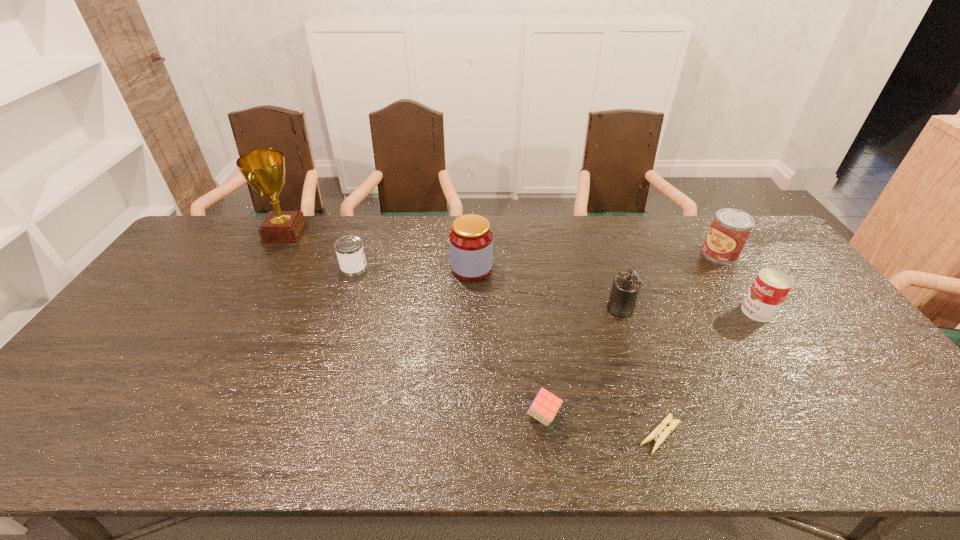
This screenshot has height=540, width=960. Identify the location of vacant point located 0.330m on the plaque of the award. (x=397, y=233).

The height and width of the screenshot is (540, 960). I want to click on vacant space located on the right of the second tallest object, so click(558, 268).

Locate an element on the screen. vacant space located on the back of the second can from left to right is located at coordinates (597, 239).

Where is `free space located 0.070m on the front of the leftmost can`? This screenshot has height=540, width=960. free space located 0.070m on the front of the leftmost can is located at coordinates (347, 292).

Find the location of a particular element. free region located 0.290m on the back of the fourth object from left to right is located at coordinates (531, 313).

I want to click on free space located 0.120m on the right of the clothespin, so click(737, 435).

Locate an element on the screen. Image resolution: width=960 pixels, height=540 pixels. award at the far edge is located at coordinates (264, 170).

Locate an element on the screen. jar located in the far edge section of the desktop is located at coordinates (471, 240).

Find the location of a particular element. The width and height of the screenshot is (960, 540). can that is at the far edge is located at coordinates (730, 229).

You are a GUI agent. You are given a task and a screenshot of the screen. Output one action in this format:
    pyautogui.click(x=<x>, y=<y>)
    Task: Click on the cube that is at the near edge
    The image size is (960, 540).
    Given the screenshot: What is the action you would take?
    pyautogui.click(x=545, y=406)